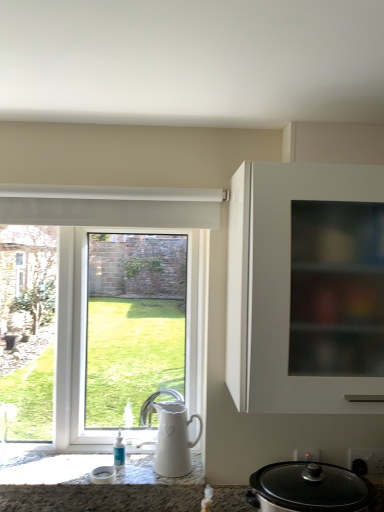
Question: Can you confirm if black glass slow cooker at lower right is shorter than white glossy window at left?

Choices:
 (A) yes
 (B) no

Answer: (A)

Question: From a real-world perspective, is black glass slow cooker at lower right under white glossy window at left?

Choices:
 (A) yes
 (B) no

Answer: (A)

Question: Is black glass slow cooker at lower right bigger than white glossy window at left?

Choices:
 (A) yes
 (B) no

Answer: (B)

Question: From the image's perspective, is black glass slow cooker at lower right on top of white glossy window at left?

Choices:
 (A) no
 (B) yes

Answer: (A)

Question: Considering the relative positions of black glass slow cooker at lower right and white glossy window at left in the image provided, is black glass slow cooker at lower right to the left of white glossy window at left from the viewer's perspective?

Choices:
 (A) no
 (B) yes

Answer: (A)

Question: Would you say black glass slow cooker at lower right is a long distance from white glossy window at left?

Choices:
 (A) no
 (B) yes

Answer: (A)

Question: From the image's perspective, does white ceramic jug at lower center appear higher than white glossy window at left?

Choices:
 (A) yes
 (B) no

Answer: (B)

Question: Is white ceramic jug at lower center thinner than white glossy window at left?

Choices:
 (A) yes
 (B) no

Answer: (A)

Question: Does white ceramic jug at lower center have a lesser height compared to white glossy window at left?

Choices:
 (A) yes
 (B) no

Answer: (A)

Question: Would you say white ceramic jug at lower center is a long distance from white glossy window at left?

Choices:
 (A) no
 (B) yes

Answer: (A)

Question: Is white ceramic jug at lower center behind white glossy window at left?

Choices:
 (A) no
 (B) yes

Answer: (A)

Question: Considering the relative positions of white ceramic jug at lower center and white glossy window at left in the image provided, is white ceramic jug at lower center to the left of white glossy window at left from the viewer's perspective?

Choices:
 (A) yes
 (B) no

Answer: (B)

Question: Is white ceramic jug at lower center located outside black glass slow cooker at lower right?

Choices:
 (A) yes
 (B) no

Answer: (A)